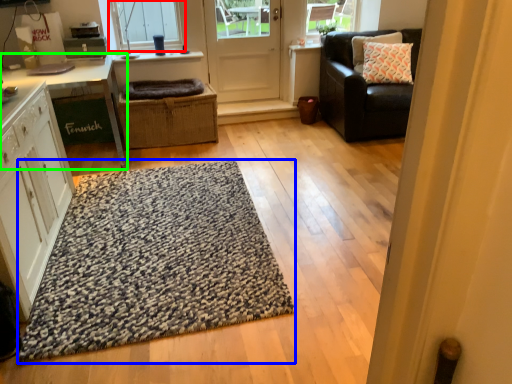
Question: Which is nearer to the window (highlighted by a red box)? doormat (highlighted by a blue box) or table (highlighted by a green box).

Choices:
 (A) doormat
 (B) table

Answer: (B)